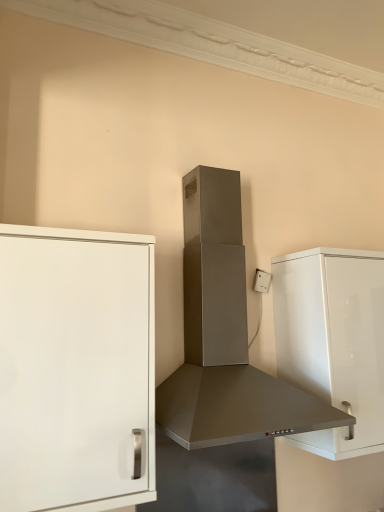
Question: Is white plastic electric outlet at upper right further to camera compared to satin silver range hood at center?

Choices:
 (A) yes
 (B) no

Answer: (A)

Question: From a real-world perspective, is white plastic electric outlet at upper right under satin silver range hood at center?

Choices:
 (A) yes
 (B) no

Answer: (B)

Question: From the image's perspective, is white plastic electric outlet at upper right under satin silver range hood at center?

Choices:
 (A) yes
 (B) no

Answer: (A)

Question: From a real-world perspective, is white plastic electric outlet at upper right on satin silver range hood at center?

Choices:
 (A) no
 (B) yes

Answer: (B)

Question: Does white plastic electric outlet at upper right have a larger size compared to satin silver range hood at center?

Choices:
 (A) no
 (B) yes

Answer: (A)

Question: Looking at their shapes, would you say white glossy cabinet at right, which ranks as the 1th cabinetry in back-to-front order, is wider or thinner than white plastic electric outlet at upper right?

Choices:
 (A) wide
 (B) thin

Answer: (A)

Question: Is point (284, 297) positioned closer to the camera than point (264, 289)?

Choices:
 (A) closer
 (B) farther

Answer: (A)

Question: From their relative heights in the image, would you say white glossy cabinet at right, the 1th cabinetry from the right, is taller or shorter than white plastic electric outlet at upper right?

Choices:
 (A) short
 (B) tall

Answer: (B)

Question: Choose the correct answer: Is white glossy cabinet at right, the 1th cabinetry from the right, inside white plastic electric outlet at upper right or outside it?

Choices:
 (A) inside
 (B) outside

Answer: (B)

Question: Considering the positions of satin silver range hood at center and white plastic electric outlet at upper right in the image, is satin silver range hood at center wider or thinner than white plastic electric outlet at upper right?

Choices:
 (A) wide
 (B) thin

Answer: (A)

Question: Does point (216, 170) appear closer or farther from the camera than point (269, 282)?

Choices:
 (A) farther
 (B) closer

Answer: (B)

Question: In terms of size, does satin silver range hood at center appear bigger or smaller than white plastic electric outlet at upper right?

Choices:
 (A) small
 (B) big

Answer: (B)

Question: From a real-world perspective, is satin silver range hood at center above or below white plastic electric outlet at upper right?

Choices:
 (A) above
 (B) below

Answer: (B)

Question: Considering the positions of white plastic electric outlet at upper right and white glossy cabinet at right, the 1th cabinetry from the right, in the image, is white plastic electric outlet at upper right taller or shorter than white glossy cabinet at right, the 1th cabinetry from the right,?

Choices:
 (A) short
 (B) tall

Answer: (A)

Question: Is white plastic electric outlet at upper right inside the boundaries of white glossy cabinet at right, which ranks as the 1th cabinetry in back-to-front order, or outside?

Choices:
 (A) inside
 (B) outside

Answer: (B)